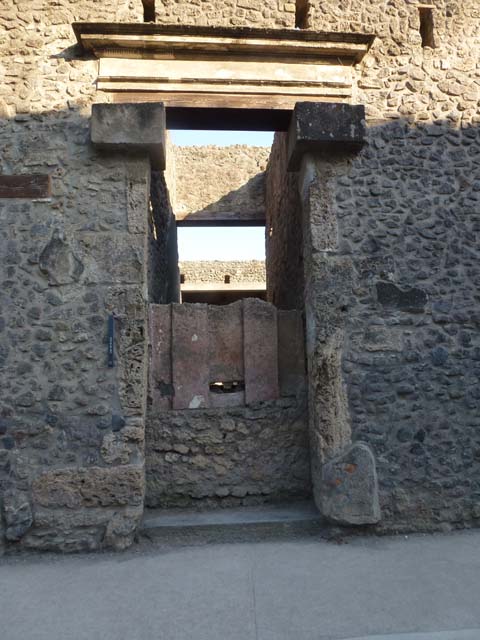
Image resolution: width=480 pixels, height=640 pixels. I want to click on black door, so click(x=227, y=280), click(x=182, y=278).